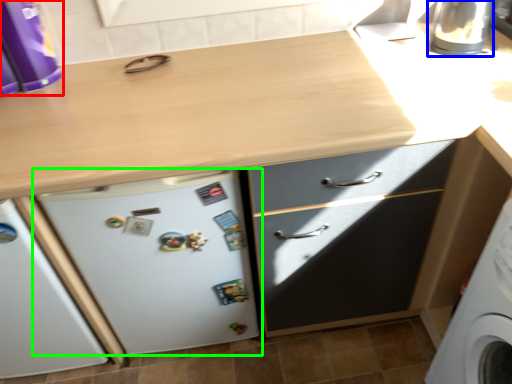
Question: Which is farther away from kitchen appliance (highlighted by a red box)? appliance (highlighted by a blue box) or refrigerator (highlighted by a green box)?

Choices:
 (A) appliance
 (B) refrigerator

Answer: (A)